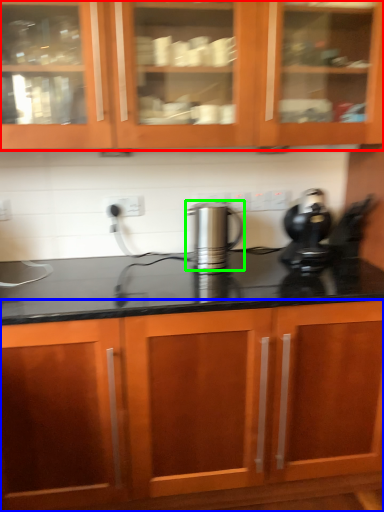
Question: Which object is positioned farthest from cabinetry (highlighted by a red box)? Select from cabinetry (highlighted by a blue box) and kitchen appliance (highlighted by a green box).

Choices:
 (A) cabinetry
 (B) kitchen appliance

Answer: (A)